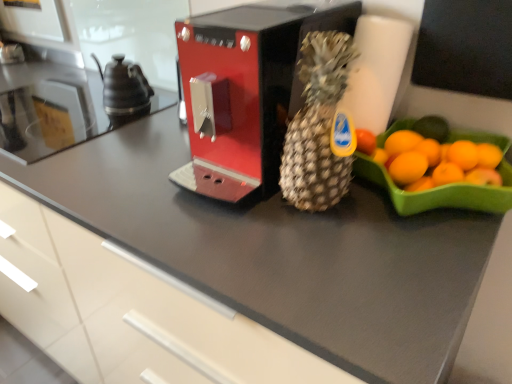
The image size is (512, 384). I want to click on free spot above satin black countertop at left (from a real-world perspective), so click(x=58, y=109).